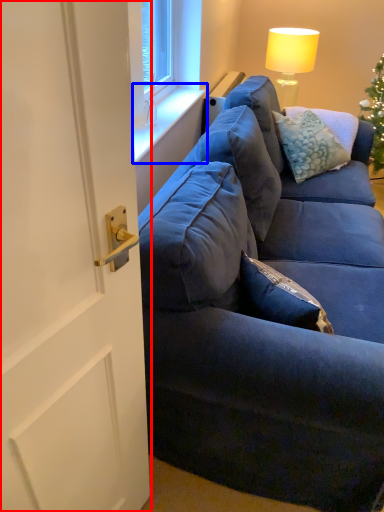
Question: Which object is closer to the camera taking this photo, door (highlighted by a red box) or window sill (highlighted by a blue box)?

Choices:
 (A) door
 (B) window sill

Answer: (A)